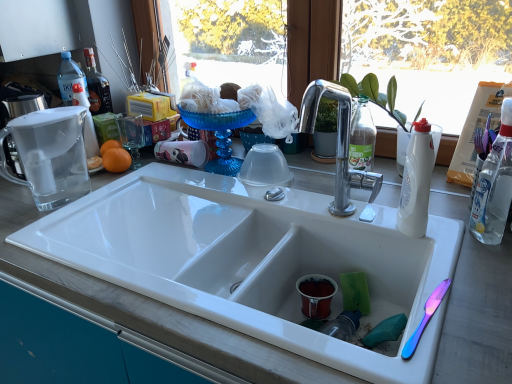
I want to click on free region on the left part of white plastic bottle at right, which appears as the 2th bottle when viewed from the back, so click(344, 217).